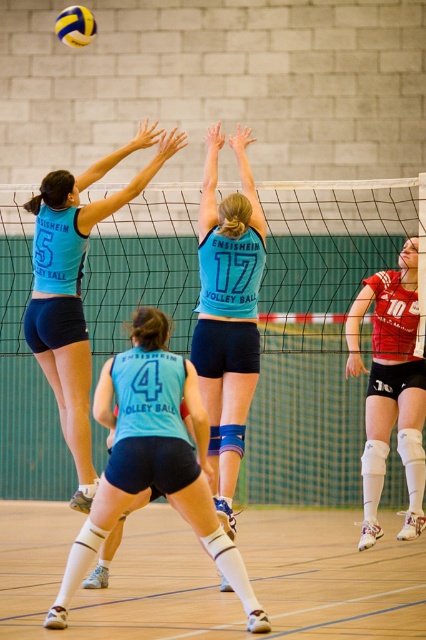
You are a volleyball coach observing the game. You need to decide if a player in the teal jersey at center can pass the ball to the matte blue jersey at upper left without violating the 4 feet distance rule. Can they?

The distance between the teal jersey at center and the matte blue jersey at upper left is 4.07 feet, which is slightly over the 4 feet rule. Therefore, the pass would be legal as it exceeds the minimum distance requirement.

You are a volleyball player positioned at the edge of the court. You want to serve the ball over the black mesh net at center. Based on the court layout, is the net positioned centrally along the court?

The black mesh net at center is located at point (316, 333), which indicates it is positioned centrally along the court.